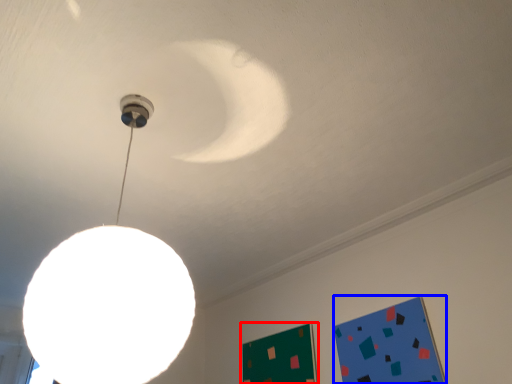
Question: Which of the following is the closest to the observer, bulletin board (highlighted by a red box) or bulletin board (highlighted by a blue box)?

Choices:
 (A) bulletin board
 (B) bulletin board

Answer: (B)